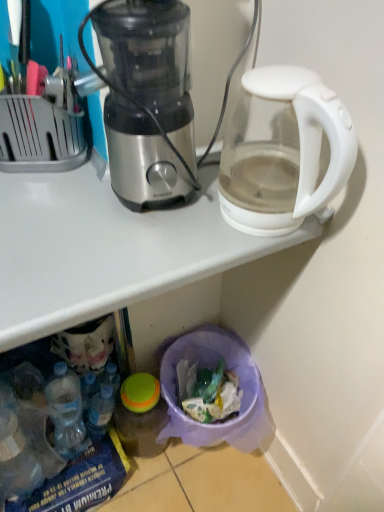
You are a GUI agent. You are given a task and a screenshot of the screen. Output one action in this format:
    pyautogui.click(x=<x>, y=<y>)
    Task: Click on the free location in front of translucent plastic bottle at lower left
    The width and height of the screenshot is (384, 512).
    Given the screenshot: What is the action you would take?
    pyautogui.click(x=72, y=471)